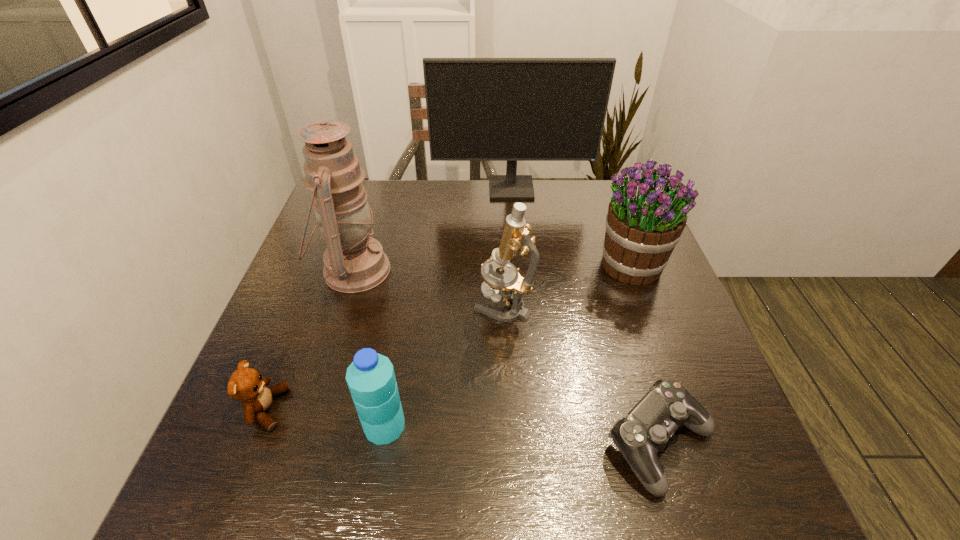
You are a GUI agent. You are given a task and a screenshot of the screen. Output one action in this format:
    pyautogui.click(x=<x>, y=<y>)
    Task: Click on the computer monitor
    
    Given the screenshot: What is the action you would take?
    pyautogui.click(x=478, y=109)

Where is `oil lamp`? oil lamp is located at coordinates (354, 262).

You are a GUI agent. You are given a task and a screenshot of the screen. Output one action in this format:
    pyautogui.click(x=<x>, y=<y>)
    Task: Click on the microscope
    The image size is (960, 540).
    Given the screenshot: What is the action you would take?
    pyautogui.click(x=516, y=240)

Identify the location of bouquet. The width and height of the screenshot is (960, 540). (645, 220).

Find the location of `the fifth tallest object`. the fifth tallest object is located at coordinates (x=371, y=379).

Image resolution: width=960 pixels, height=540 pixels. I want to click on teddy bear, so click(246, 384).

You are a GUI agent. You are given a task and a screenshot of the screen. Output one action in this format:
    pyautogui.click(x=<x>, y=<y>)
    Task: Click on the shortest object
    The image size is (960, 540).
    Given the screenshot: What is the action you would take?
    pyautogui.click(x=645, y=430)

Where is `vacant space located 0.230m on the front-facing side of the farthest object`? The width and height of the screenshot is (960, 540). vacant space located 0.230m on the front-facing side of the farthest object is located at coordinates (516, 247).

Find the location of a particular element. vacant area located on the front of the oil lamp is located at coordinates click(x=304, y=429).

What are the coordinates of `free spot located 0.190m on the front of the microscope` in the screenshot? It's located at (508, 396).